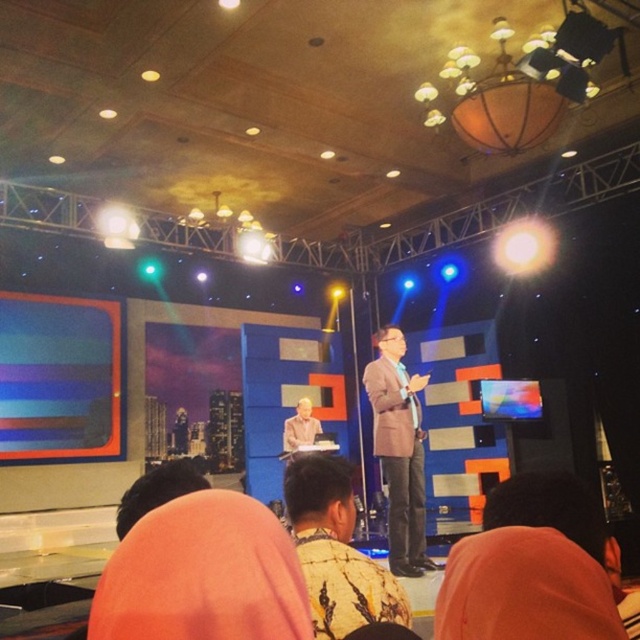
Between point (417, 472) and point (496, 522), which one is positioned behind?

The point (417, 472) is more distant.

Who is shorter, brown textured suit at center or orange fabric at lower right?

orange fabric at lower right

Image resolution: width=640 pixels, height=640 pixels. What are the coordinates of `brown textured suit at center` in the screenshot? It's located at (400, 451).

Find the location of a particular element. brown textured suit at center is located at coordinates (400, 451).

Between brown textured suit at center and light brown wood desk at center, which one has more height?

brown textured suit at center

Which is behind, point (384, 346) or point (308, 444)?

Positioned behind is point (308, 444).

You are a GUI agent. You are given a task and a screenshot of the screen. Output one action in this format:
    pyautogui.click(x=<x>, y=<y>)
    Task: Click on the brown textured suit at center
    The width and height of the screenshot is (640, 640).
    Given the screenshot: What is the action you would take?
    pyautogui.click(x=400, y=451)

Is point (330, 504) positioned in front of point (596, 547)?

No, (330, 504) is behind (596, 547).

Does patterned fabric shirt at center have a lesser width compared to orange fabric at lower right?

No, patterned fabric shirt at center is not thinner than orange fabric at lower right.

Does point (305, 452) come closer to viewer compared to point (525, 476)?

No.

Locate an element on the screen. This screenshot has height=640, width=640. patterned fabric shirt at center is located at coordinates (337, 548).